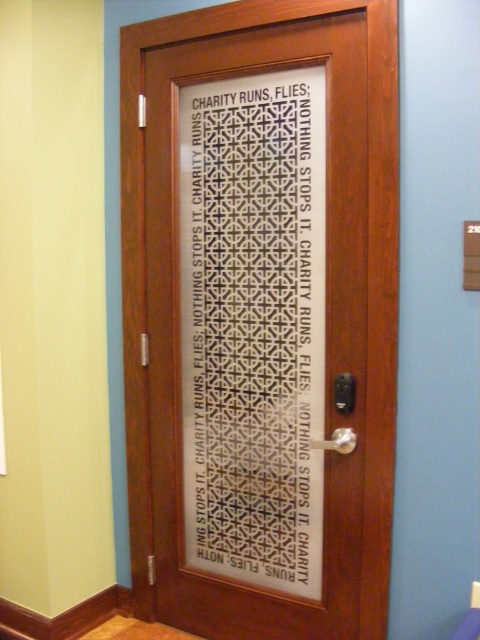
Can you confirm if transparent glass door at center is positioned below white lattice door at center?

Yes, transparent glass door at center is below white lattice door at center.

Is point (377, 44) positioned after point (201, 522)?

That is False.

Between point (263, 40) and point (266, 182), which one is positioned behind?

The point (266, 182) is behind.

What are the coordinates of `transparent glass door at center` in the screenshot? It's located at (261, 316).